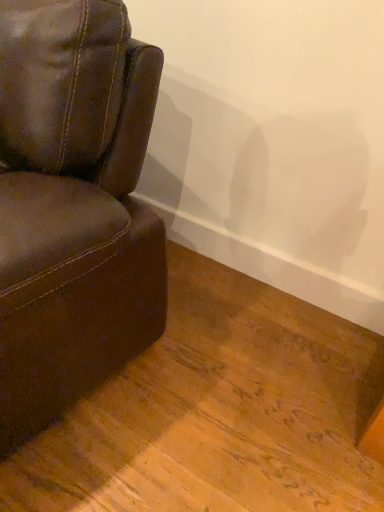
Measure the distance between point (0, 390) and camera.

Point (0, 390) and camera are 32.80 inches apart.

The image size is (384, 512). What are the coordinates of `brown leather chair at left` in the screenshot? It's located at (73, 206).

This screenshot has height=512, width=384. What do you see at coordinates (73, 206) in the screenshot? I see `brown leather chair at left` at bounding box center [73, 206].

The height and width of the screenshot is (512, 384). Identify the location of brown leather chair at left. (73, 206).